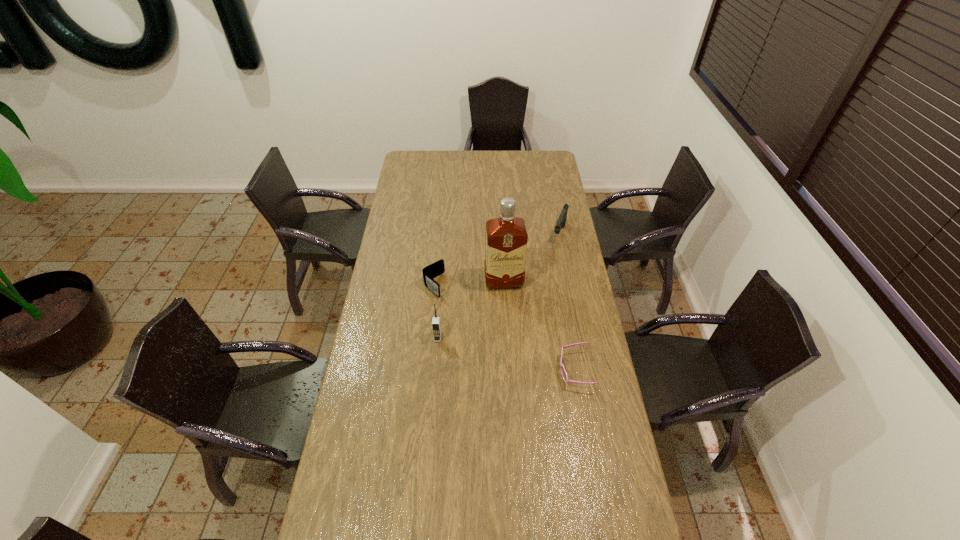
Locate an element on the screen. The width and height of the screenshot is (960, 540). vacant position in the image that satisfies the following two spatial constraints: 1. on the front-facing side of the fourth shortest object; 2. on the front-facing side of the nearest object is located at coordinates (435, 370).

Locate an element on the screen. free spot that satisfies the following two spatial constraints: 1. on the front-facing side of the second tallest object; 2. on the front-facing side of the shortest object is located at coordinates click(435, 370).

Image resolution: width=960 pixels, height=540 pixels. Identify the location of free space that satisfies the following two spatial constraints: 1. on the front side of the nearest object; 2. on the front-facing side of the second shortest object. point(425,370).

Locate an element on the screen. This screenshot has width=960, height=540. vacant space that satisfies the following two spatial constraints: 1. on the front-facing side of the second nearest object; 2. on the front-facing side of the shortest object is located at coordinates (435, 370).

This screenshot has width=960, height=540. What are the coordinates of `free spot that satisfies the following two spatial constraints: 1. on the front-facing side of the second nearest object; 2. on the front-facing side of the nearest object` in the screenshot? It's located at (435, 370).